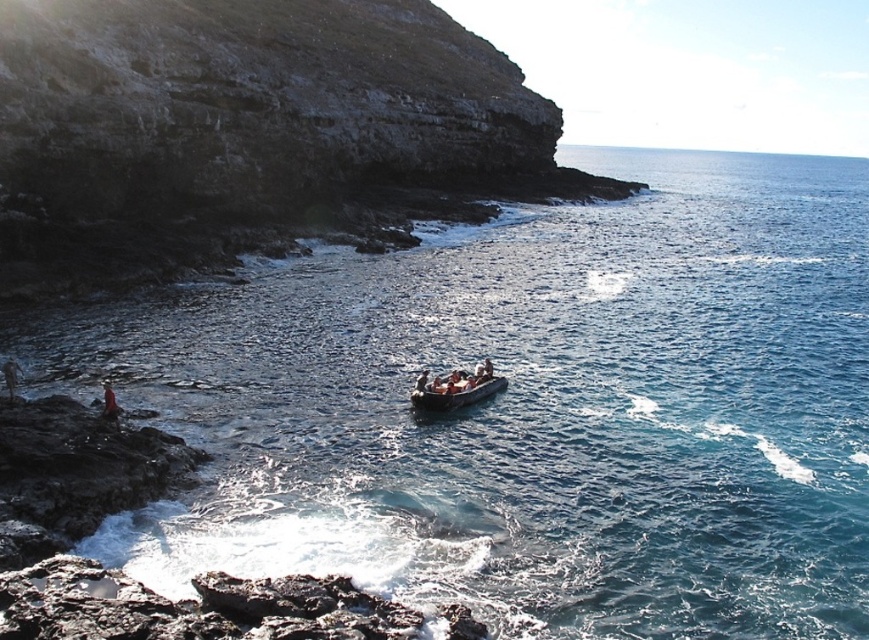
You are standing on the rocky shore and see the smooth gray boat at center and the smooth skin person at center. If you want to throw a lifebuoy to the person, will it reach them before the boat?

The smooth gray boat at center is 5.04 feet away from the smooth skin person at center. Since the boat is closer to the person, the lifebuoy would likely reach the person before the boat arrives.

You are standing at the point with coordinates point (418, 376) and want to walk to the point with coordinates point (105, 396). Which direction should you move relative to your current position?

You should move forward because point (105, 396) is in front of point (418, 376).